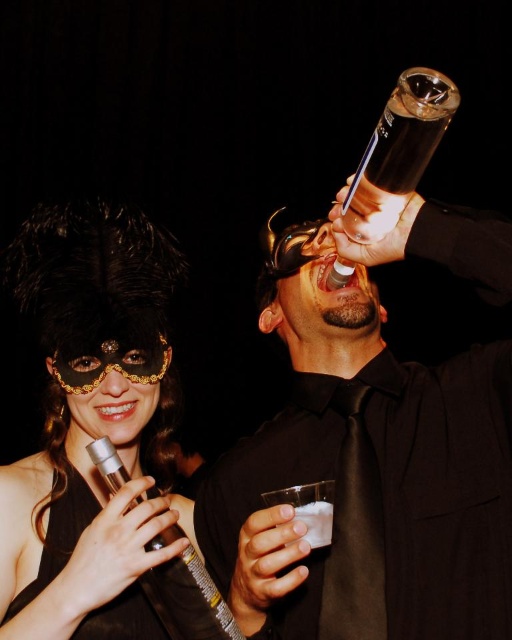
Is shiny black bottle at upper center bigger than clear glass at upper center?

Yes.

Does shiny black bottle at upper center appear over clear glass at upper center?

Correct, shiny black bottle at upper center is located above clear glass at upper center.

Between point (437, 496) and point (326, 509), which one is positioned behind?

Point (437, 496)

Where is `shiny black bottle at upper center`? shiny black bottle at upper center is located at coordinates (369, 483).

Does shiny black bottle at upper center have a larger size compared to silver metallic microphone at lower left?

Yes.

What do you see at coordinates (369, 483) in the screenshot? I see `shiny black bottle at upper center` at bounding box center [369, 483].

The width and height of the screenshot is (512, 640). In order to click on shiny black bottle at upper center in this screenshot , I will do `click(369, 483)`.

Can you confirm if matte black mask at upper left is smaller than silver metallic microphone at lower left?

No, matte black mask at upper left is not smaller than silver metallic microphone at lower left.

The width and height of the screenshot is (512, 640). I want to click on matte black mask at upper left, so pyautogui.click(x=90, y=420).